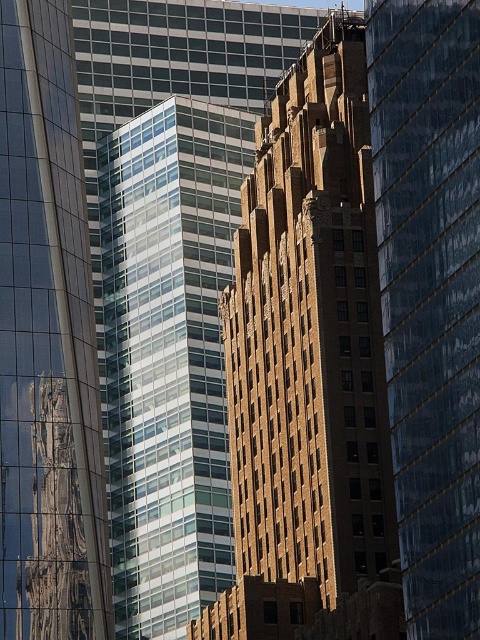
You are standing in front of the central skyscraper and see two points marked on the building. The first point is at coordinates point (402, 145) and the second is at point (63, 593). Which point is closer to your eyes?

Point (402, 145) is further to the camera than point (63, 593), so the point closer to your eyes is point (63, 593).

You are standing in the urban scene and want to locate the point at coordinates (431, 294). Which building should you look at to find this point?

The point at coordinates (431, 294) is located on the brown brick building at center, so you should look at the brown brick building at center to find this point.

You are an architect evaluating the urban layout. From your vantage point, which building is closer to you, the brown brick building at center or the glassy reflective skyscraper at left?

The brown brick building at center is closer because it is positioned in front of the glassy reflective skyscraper at left, obscuring part of it from view.